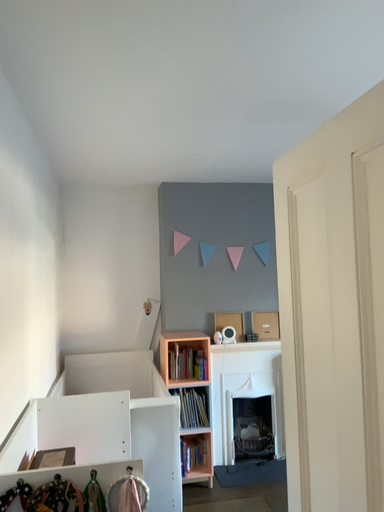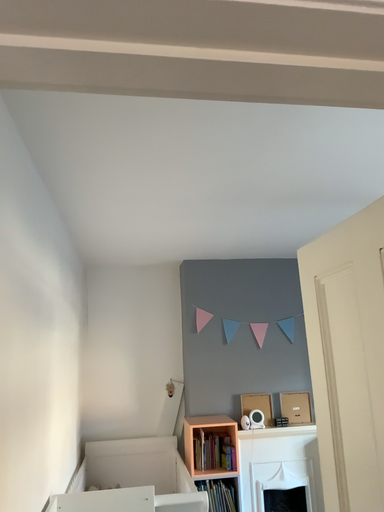
Question: How did the camera likely rotate when shooting the video?

Choices:
 (A) rotated downward
 (B) rotated upward

Answer: (B)